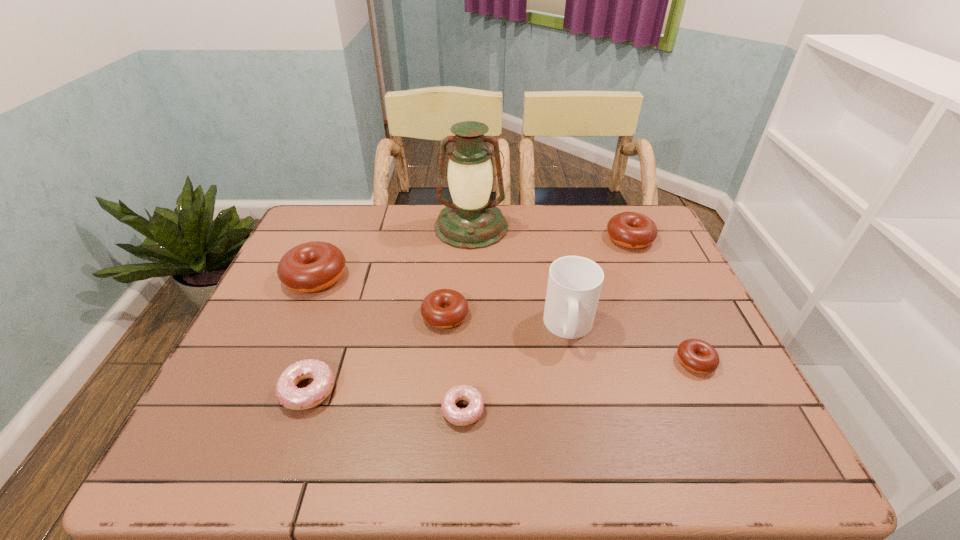
The image size is (960, 540). What are the coordinates of `lantern` in the screenshot? It's located at (470, 221).

Identify the location of white mug. (574, 284).

I want to click on mug, so click(x=574, y=284).

The width and height of the screenshot is (960, 540). What are the coordinates of `the third nearest chocolate doughnut` in the screenshot? It's located at (309, 267).

You are a GUI agent. You are given a task and a screenshot of the screen. Output one action in this format:
    pyautogui.click(x=<x>, y=<y>)
    Task: Click on the second farthest doughnut
    This screenshot has height=540, width=960.
    Given the screenshot: What is the action you would take?
    pyautogui.click(x=309, y=267)

Locate an element on the screen. Image resolution: width=960 pixels, height=540 pixels. the fourth tallest object is located at coordinates (634, 230).

At what (x,y) coordinates should I click in order to perform the action: click on the farthest doughnut. Please return your answer as a coordinate pair (x, y). This screenshot has height=540, width=960. Looking at the image, I should click on pyautogui.click(x=634, y=230).

This screenshot has height=540, width=960. I want to click on the fourth nearest doughnut, so click(x=444, y=308).

You are a GUI agent. You are given a task and a screenshot of the screen. Output one action in this format:
    pyautogui.click(x=<x>, y=<y>)
    Task: Click on the third farthest chocolate doughnut
    The height and width of the screenshot is (540, 960).
    Given the screenshot: What is the action you would take?
    pyautogui.click(x=444, y=308)

Where is `the left pink doughnut`? The height and width of the screenshot is (540, 960). the left pink doughnut is located at coordinates (290, 396).